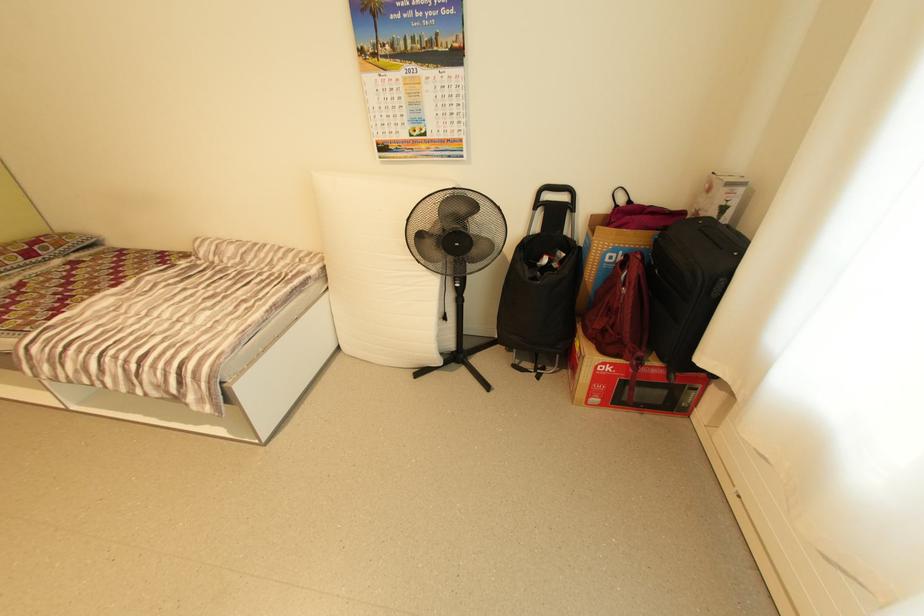
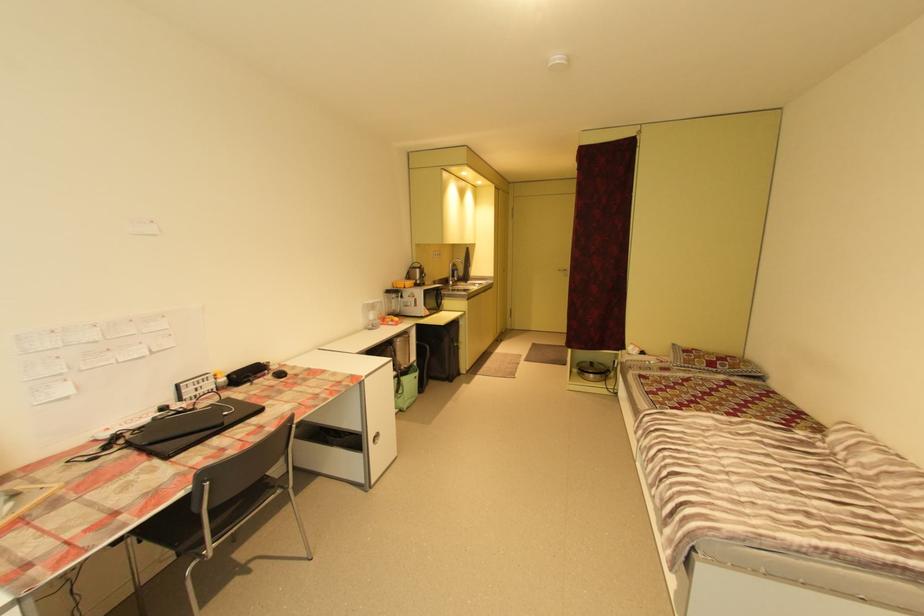
Question: Based on the continuous images, in which direction is the camera rotating? Reply with the corresponding letter.

Choices:
 (A) Left
 (B) Right
 (C) Up
 (D) Down

Answer: (A)